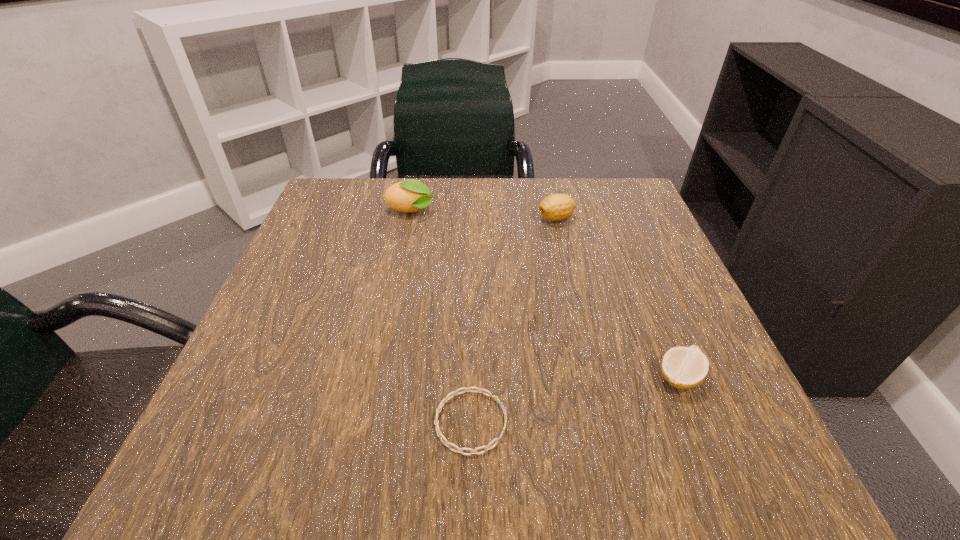
Locate an element on the screen. The width and height of the screenshot is (960, 540). free space that satisfies the following two spatial constraints: 1. at the stem end of the second object from right to left; 2. on the right side of the rightmost lemon is located at coordinates (592, 377).

Locate an element on the screen. The width and height of the screenshot is (960, 540). vacant space that satisfies the following two spatial constraints: 1. on the back side of the second shortest object; 2. with leaves positioned above the tallest lemon is located at coordinates (612, 212).

This screenshot has height=540, width=960. I want to click on vacant space that satisfies the following two spatial constraints: 1. with leaves positioned above the tallest object; 2. on the left side of the shortest lemon, so click(x=376, y=377).

Where is `free location that satisfies the following two spatial constraints: 1. on the back side of the rightmost lemon; 2. at the stem end of the second object from right to left`? The width and height of the screenshot is (960, 540). free location that satisfies the following two spatial constraints: 1. on the back side of the rightmost lemon; 2. at the stem end of the second object from right to left is located at coordinates (615, 219).

Where is `free point that satisfies the following two spatial constraints: 1. on the back side of the second shortest object; 2. with leaves positioned above the tallest lemon`? free point that satisfies the following two spatial constraints: 1. on the back side of the second shortest object; 2. with leaves positioned above the tallest lemon is located at coordinates (612, 212).

At what (x,y) coordinates should I click in order to perform the action: click on free space that satisfies the following two spatial constraints: 1. at the stem end of the nearest lemon; 2. on the right side of the second shortest lemon. Please return your answer as a coordinate pair (x, y). Looking at the image, I should click on (592, 377).

I want to click on free spot that satisfies the following two spatial constraints: 1. on the back side of the rightmost object; 2. with leaves positioned above the leftmost object, so click(612, 212).